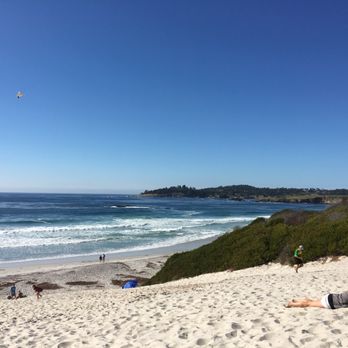
You are a GUI agent. You are given a task and a screenshot of the screen. Output one action in this format:
    pyautogui.click(x=<x>, y=<y>)
    Task: Click on the foam
    This screenshot has height=348, width=348.
    Given the screenshot: What is the action you would take?
    pyautogui.click(x=38, y=233)